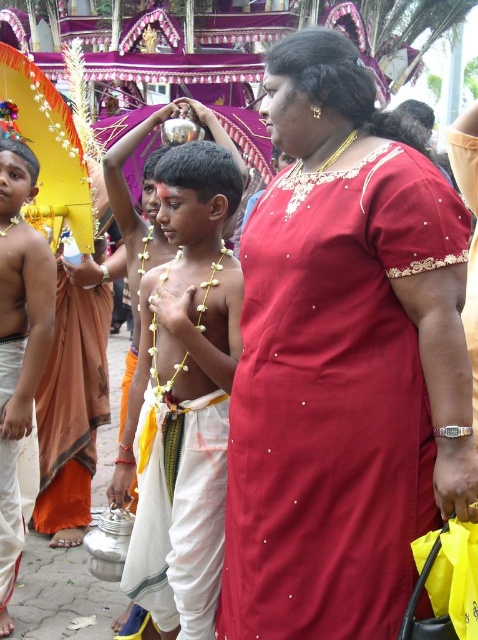
Based on the photo, you are a photographer trying to capture a group photo of the white cloth boy at center and the orange silk sari at left. Your camera has a maximum focus range of 6 meters. Can you fit both subjects into the frame without moving either of them?

The white cloth boy at center and the orange silk sari at left are 6.55 meters apart, which exceeds the camera maximum focus range of 6 meters. Therefore, you cannot fit both subjects into the frame without moving them.

You are a photographer trying to capture the cultural procession. You want to position yourself so that the white cloth boy at center is in the center of your photo. Given that the boy is at point 0.539 on the x and 0.040 on the y axis, what adjustments should you make to your camera position?

To center the white cloth boy at center in your photo, adjust your camera so that the crosshairs align with the coordinates x 0.539 and y 0.040.

You are a photographer trying to capture the cultural procession scene. You notice two points marked as point 1 and point 2 in the image. Point 1 is at coordinates point (x=2, y=330) and point 2 is at point (x=63, y=401). From your position, which point is closer to you?

Point (x=2, y=330) is in front of point (x=63, y=401), so point 1 is closer to you.